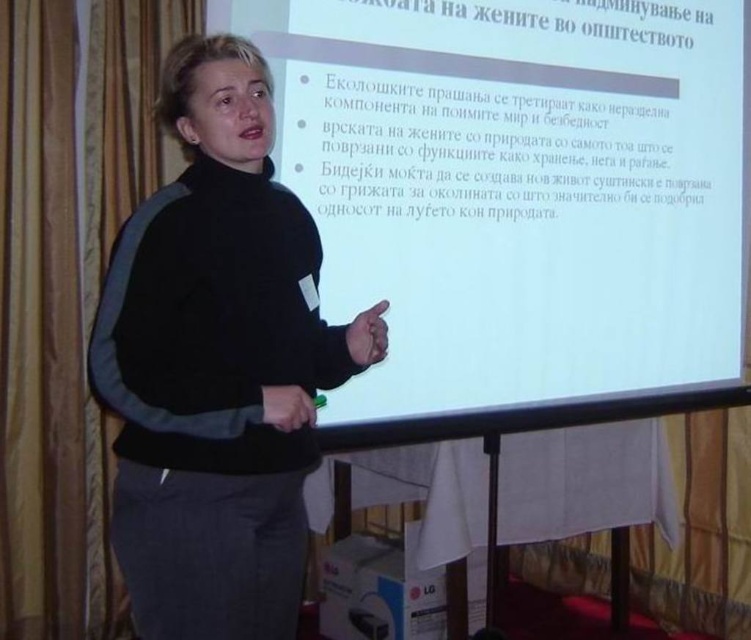
You are a presenter standing at the front of the room. You need to adjust the focus of your projector to ensure the text on the white matte projection screen at upper center is clear. The projector has a manual focus ring that requires you to turn it clockwise to increase the distance setting. Since you are standing 1.85 meters away from the screen, should you turn the focus ring clockwise or counterclockwise to achieve sharp text?

The white matte projection screen at upper center is 1.85 meters away from the viewer. Since the projector requires turning the focus ring clockwise to increase the distance setting, and the screen is 1.85 meters away, you should turn the focus ring clockwise to set the focus to match the distance and achieve sharp text.

You are setting up a camera to record a presentation. The camera is placed 6.06 feet away from the white matte projection screen at upper center. If the presenter wants the camera to capture both the screen and their gestures clearly, where should you position the camera relative to the screen?

The camera should be positioned directly in front of the white matte projection screen at upper center, as it is 6.06 feet away from the screen. This placement ensures the camera captures both the screen content and the presenter gesturing in front of it clearly.